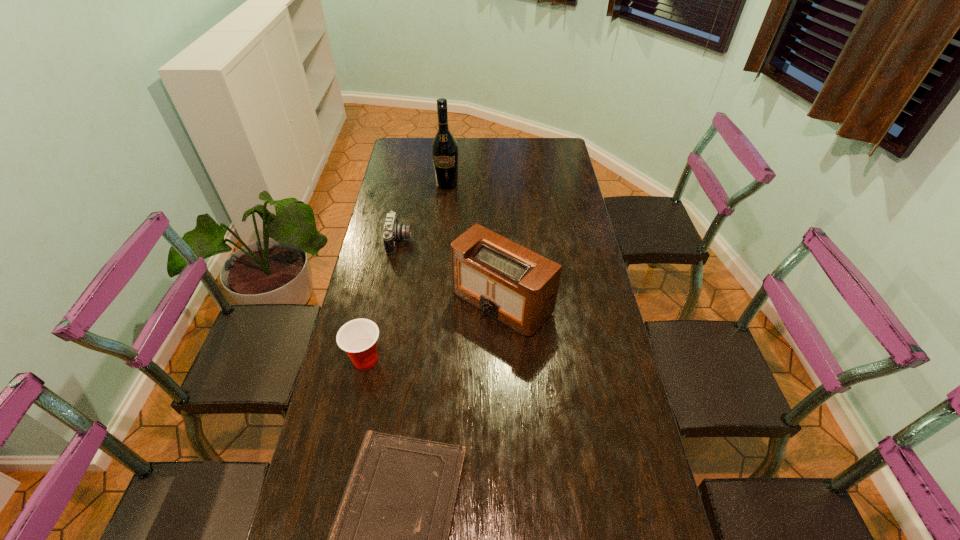
Find the location of a particular element. the tallest object is located at coordinates click(x=444, y=146).

This screenshot has width=960, height=540. I want to click on the farthest object, so click(444, 146).

At what (x,y) coordinates should I click in order to perform the action: click on the third farthest object. Please return your answer as a coordinate pair (x, y). This screenshot has height=540, width=960. Looking at the image, I should click on (516, 286).

Identify the location of radio receiver. (516, 286).

The width and height of the screenshot is (960, 540). In order to click on the third shortest object in this screenshot , I will do `click(358, 338)`.

Where is `cup`? The width and height of the screenshot is (960, 540). cup is located at coordinates (358, 338).

At what (x,y) coordinates should I click in order to perform the action: click on the fourth tallest object. Please return your answer as a coordinate pair (x, y). Looking at the image, I should click on (393, 231).

Locate an element on the screen. This screenshot has width=960, height=540. the fourth nearest object is located at coordinates (393, 231).

Find the location of `vacant space located 0.110m on the label of the wine bottle`. vacant space located 0.110m on the label of the wine bottle is located at coordinates (444, 207).

This screenshot has height=540, width=960. In order to click on free spot located 0.380m on the front of the third farthest object in this screenshot , I will do `click(510, 463)`.